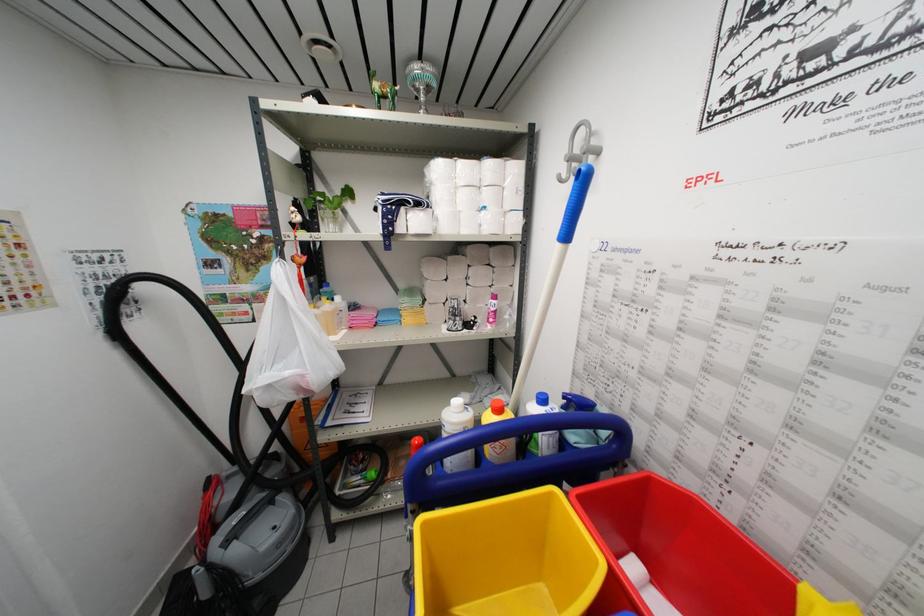
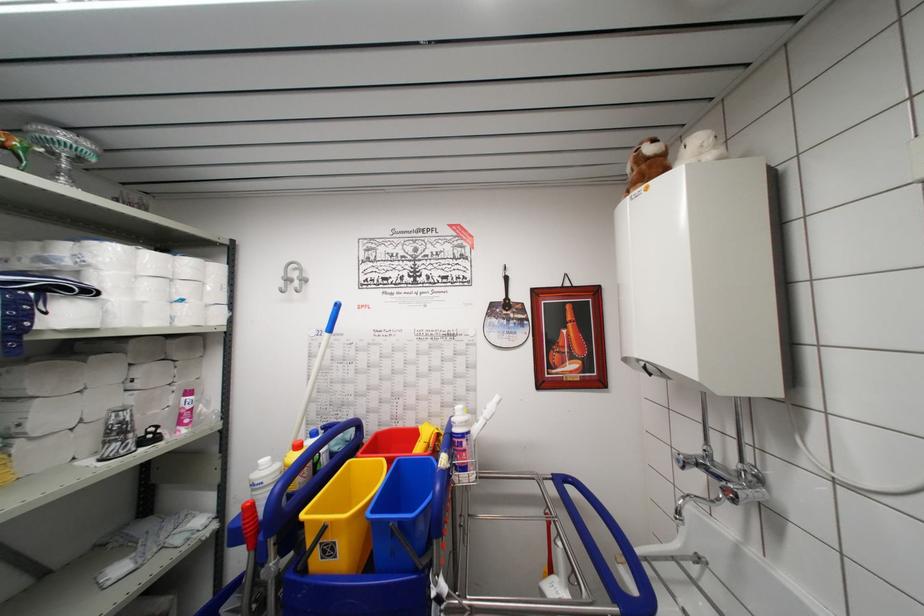
Where in the second image is the point corresponding to (496,277) from the first image?

(178, 371)